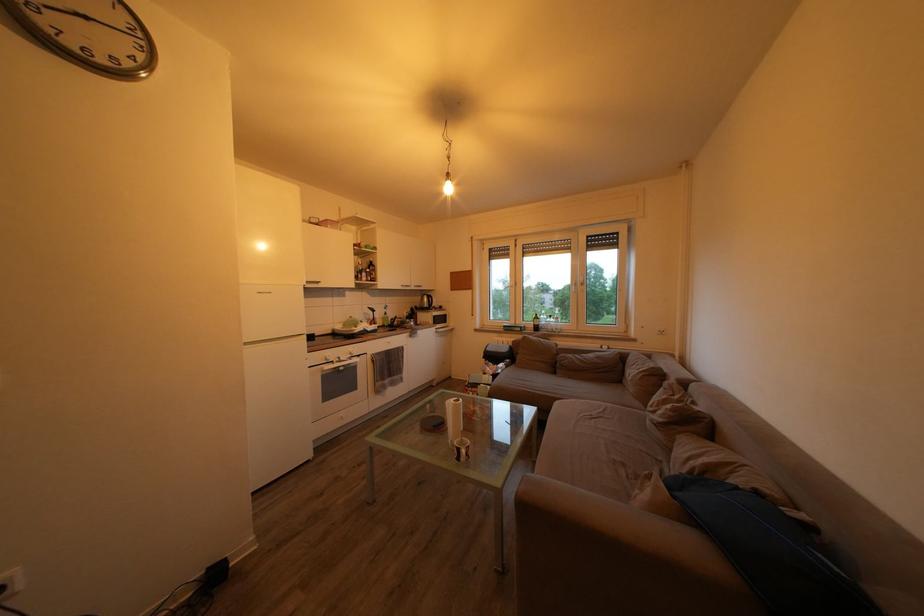
What do you see at coordinates (558, 246) in the screenshot? I see `a window blind strap` at bounding box center [558, 246].